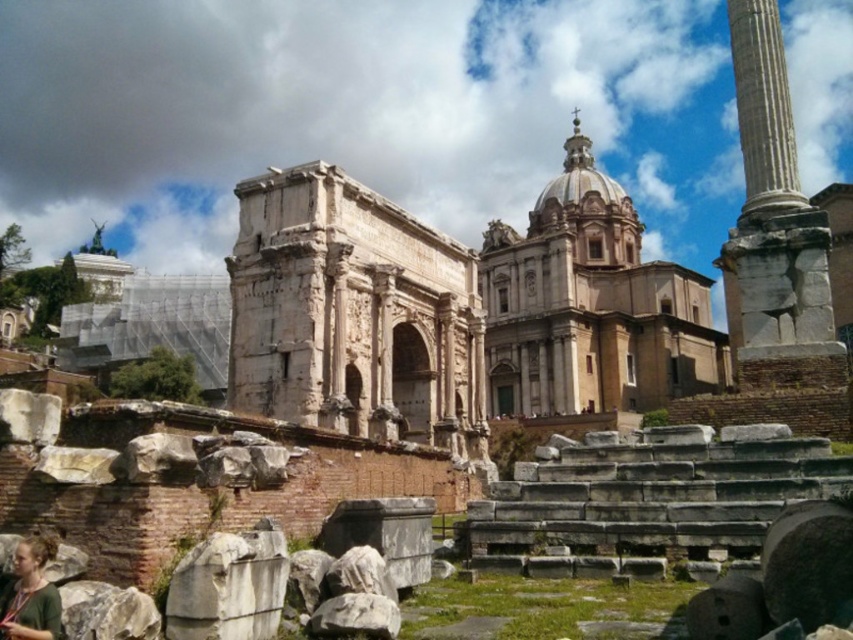
You are a tourist visiting the historical site and want to take a photo of the light brown stone church at center. However, there is a person wearing a green fabric shirt at lower left blocking your view. Can you estimate whether the person is shorter than the church to avoid obstruction?

The light brown stone church at center is much taller than the green fabric shirt at lower left, so the person wearing the green fabric shirt at lower left is shorter and less likely to block the view of the church.